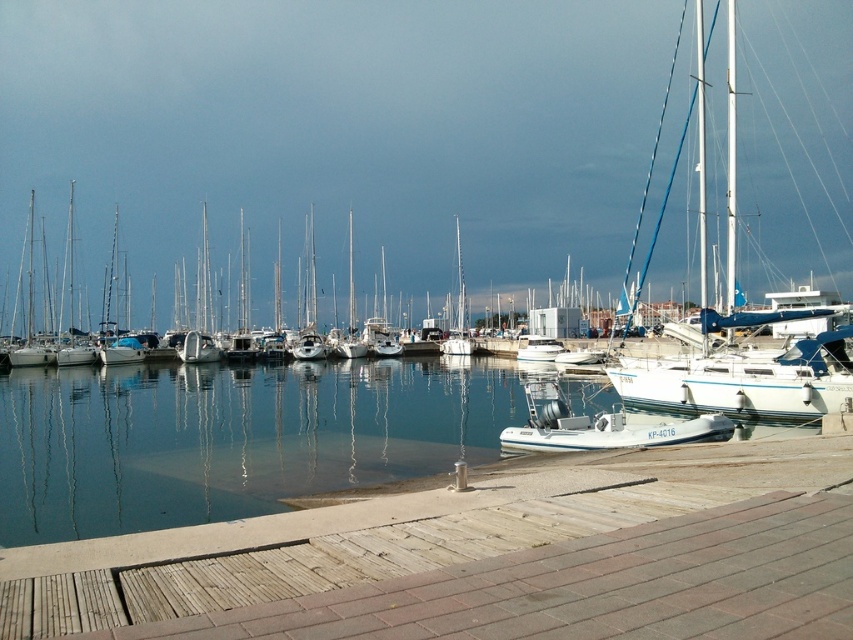
Question: Which point appears farthest from the camera in this image?

Choices:
 (A) (761, 390)
 (B) (595, 428)

Answer: (A)

Question: Considering the real-world distances, which object is farthest from the white glossy sailboat at center?

Choices:
 (A) white rubber dinghy at center
 (B) clear water at dock center
 (C) white glossy boat at center

Answer: (C)

Question: Does white rubber dinghy at center have a greater width compared to white glossy boat at center?

Choices:
 (A) no
 (B) yes

Answer: (B)

Question: Which of the following is the closest to the observer?

Choices:
 (A) (543, 353)
 (B) (0, 529)
 (C) (595, 445)
 (D) (743, 380)

Answer: (B)

Question: Does white rubber dinghy at center have a larger size compared to white glossy boat at center?

Choices:
 (A) yes
 (B) no

Answer: (A)

Question: Does clear water at dock center appear on the left side of white rubber dinghy at center?

Choices:
 (A) no
 (B) yes

Answer: (B)